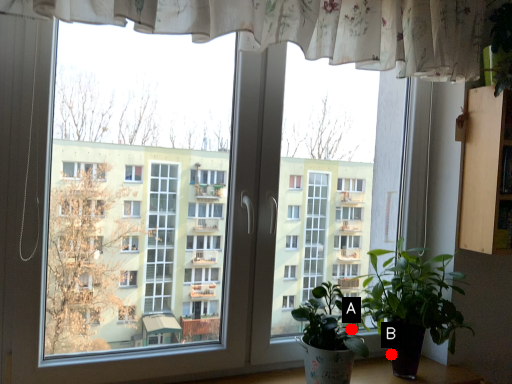
Question: Two points are circled on the image, labeled by A and B beside each circle. Which point is farther from the camera taking this photo?

Choices:
 (A) A is further
 (B) B is further

Answer: (B)